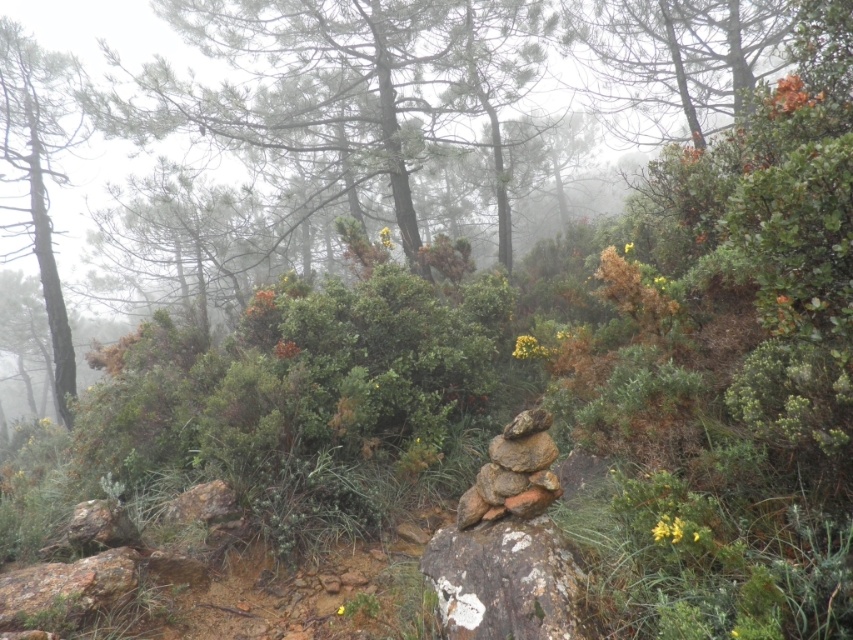
Between green leafy tree at upper center and white textured rock at center, which one has more height?

Standing taller between the two is green leafy tree at upper center.

Is green leafy tree at upper center below white textured rock at center?

No.

What do you see at coordinates (346, 88) in the screenshot?
I see `green leafy tree at upper center` at bounding box center [346, 88].

At what (x,y) coordinates should I click in order to perform the action: click on green leafy tree at upper center. Please return your answer as a coordinate pair (x, y). The height and width of the screenshot is (640, 853). Looking at the image, I should click on (346, 88).

Consider the image. Measure the distance from green leafy tree at upper center to smooth brown tree trunk at left.

green leafy tree at upper center is 20.19 feet from smooth brown tree trunk at left.

Is green leafy tree at upper center taller than smooth brown tree trunk at left?

No, green leafy tree at upper center is not taller than smooth brown tree trunk at left.

This screenshot has width=853, height=640. Describe the element at coordinates (346, 88) in the screenshot. I see `green leafy tree at upper center` at that location.

This screenshot has height=640, width=853. In order to click on green leafy tree at upper center in this screenshot , I will do `click(346, 88)`.

Is white textured rock at center positioned before smooth brown tree trunk at left?

That is True.

Can you confirm if white textured rock at center is positioned above smooth brown tree trunk at left?

No.

Who is more forward, (531, 621) or (70, 339)?

Point (531, 621)

This screenshot has height=640, width=853. I want to click on white textured rock at center, so click(506, 580).